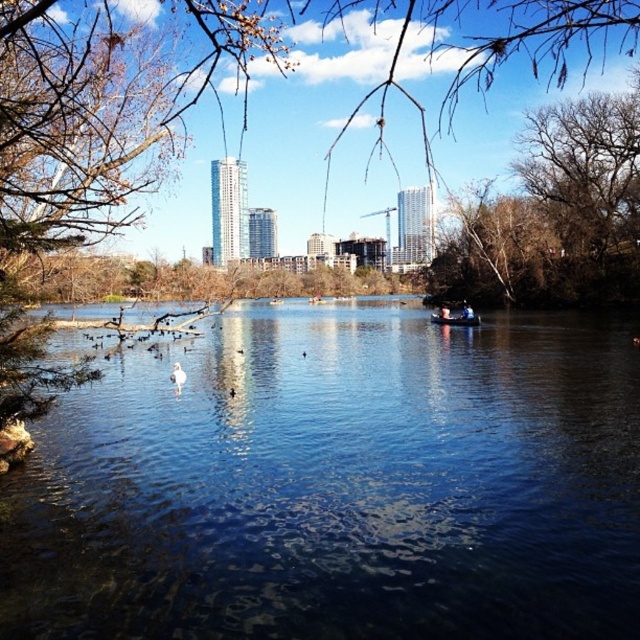
Who is lower down, brown textured tree at center or bare branches at upper right?

bare branches at upper right is below.

Is point (51, 68) closer to viewer compared to point (566, 243)?

Yes.

Identify the location of brown textured tree at center. The height and width of the screenshot is (640, 640). (102, 108).

Who is more forward, (26, 508) or (452, 324)?

Point (26, 508) is more forward.

Is clear blue water at center thinner than metallic blue boat at center?

No.

Is point (122, 504) less distant than point (465, 323)?

Yes, it is in front of point (465, 323).

Where is `clear blue water at center`? clear blue water at center is located at coordinates (339, 484).

Is clear blue water at center further to the viewer compared to white feathered bird at center?

No, clear blue water at center is in front of white feathered bird at center.

Can you confirm if clear blue water at center is positioned to the right of white feathered bird at center?

Yes, clear blue water at center is to the right of white feathered bird at center.

Who is more forward, (596,419) or (172,378)?

Point (596,419) is in front.

Where is `clear blue water at center`? Image resolution: width=640 pixels, height=640 pixels. clear blue water at center is located at coordinates (339, 484).